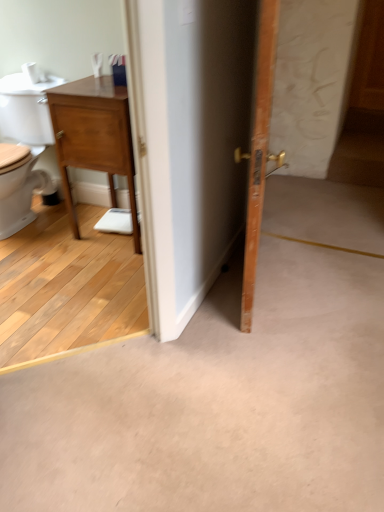
Question: Does wooden nightstand at left have a greater height compared to wooden door at right?

Choices:
 (A) no
 (B) yes

Answer: (A)

Question: Is wooden nightstand at left facing towards wooden door at right?

Choices:
 (A) yes
 (B) no

Answer: (B)

Question: Would you say wooden nightstand at left contains wooden door at right?

Choices:
 (A) yes
 (B) no

Answer: (B)

Question: Is wooden nightstand at left bigger than wooden door at right?

Choices:
 (A) yes
 (B) no

Answer: (A)

Question: Is the depth of wooden nightstand at left greater than that of wooden door at right?

Choices:
 (A) yes
 (B) no

Answer: (A)

Question: From a real-world perspective, is wooden nightstand at left on top of wooden door at right?

Choices:
 (A) yes
 (B) no

Answer: (B)

Question: Can you confirm if wooden door at right is wider than wooden nightstand at left?

Choices:
 (A) no
 (B) yes

Answer: (A)

Question: Can you confirm if wooden door at right is shorter than wooden nightstand at left?

Choices:
 (A) yes
 (B) no

Answer: (B)

Question: Is wooden door at right positioned far away from wooden nightstand at left?

Choices:
 (A) no
 (B) yes

Answer: (A)

Question: Is wooden door at right facing away from wooden nightstand at left?

Choices:
 (A) no
 (B) yes

Answer: (B)

Question: From a real-world perspective, is wooden door at right on top of wooden nightstand at left?

Choices:
 (A) no
 (B) yes

Answer: (B)

Question: From the image's perspective, is wooden door at right above wooden nightstand at left?

Choices:
 (A) no
 (B) yes

Answer: (A)

Question: From a real-world perspective, is wooden door at right above or below wooden nightstand at left?

Choices:
 (A) above
 (B) below

Answer: (A)